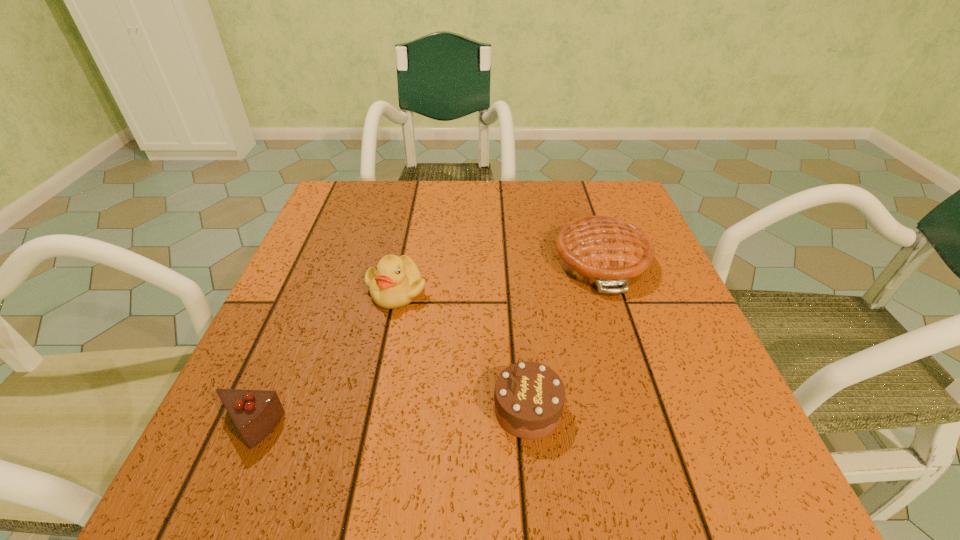
Find the location of a particular element. the second object from left to right is located at coordinates (396, 282).

This screenshot has height=540, width=960. In order to click on the rightmost object in this screenshot , I will do `click(600, 251)`.

Identify the location of the third object from left to right. The width and height of the screenshot is (960, 540). (529, 397).

Identify the location of the right chocolate cake. Image resolution: width=960 pixels, height=540 pixels. (529, 397).

Where is `the shorter chocolate cake`? the shorter chocolate cake is located at coordinates (255, 413).

Where is `the left chocolate cake`? the left chocolate cake is located at coordinates pos(255,413).

You are a GUI agent. You are given a task and a screenshot of the screen. Output one action in this format:
    pyautogui.click(x=<x>, y=<y>)
    Task: Click on the free space located at the face of the third object from right to left
    Image resolution: width=960 pixels, height=540 pixels.
    Given the screenshot: What is the action you would take?
    pyautogui.click(x=385, y=345)

What are the coordinates of `free space located 0.260m on the left of the pie` in the screenshot? It's located at (430, 261).

In order to click on vacant space situated on the left of the right chocolate cake in this screenshot , I will do `click(232, 409)`.

Locate an element on the screen. vacant space situated 0.320m on the right of the shortest object is located at coordinates (502, 428).